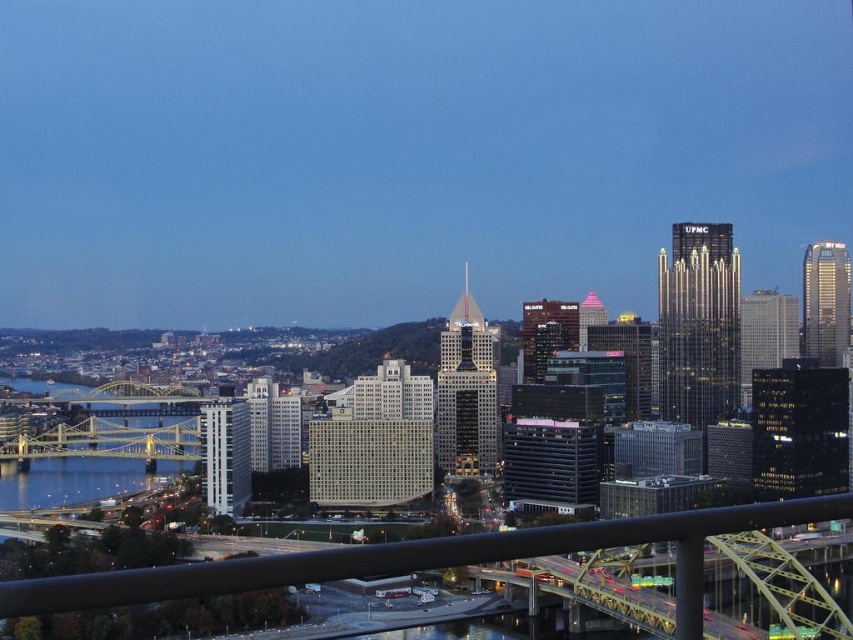
Question: Which object is farther from the camera taking this photo?

Choices:
 (A) yellow metallic bridge at left
 (B) blue glassy water at lower left

Answer: (B)

Question: Which is farther from the blue glassy water at lower left?

Choices:
 (A) yellow metallic bridge at left
 (B) black matte rail at lower center

Answer: (B)

Question: Which of the following is the closest to the observer?

Choices:
 (A) tap(109, 484)
 (B) tap(83, 397)

Answer: (A)

Question: Does yellow metallic bridge at left appear under blue glassy water at lower left?

Choices:
 (A) yes
 (B) no

Answer: (B)

Question: Can you confirm if black matte rail at lower center is smaller than yellow metallic bridge at left?

Choices:
 (A) yes
 (B) no

Answer: (B)

Question: Is black matte rail at lower center smaller than blue glassy water at lower left?

Choices:
 (A) yes
 (B) no

Answer: (B)